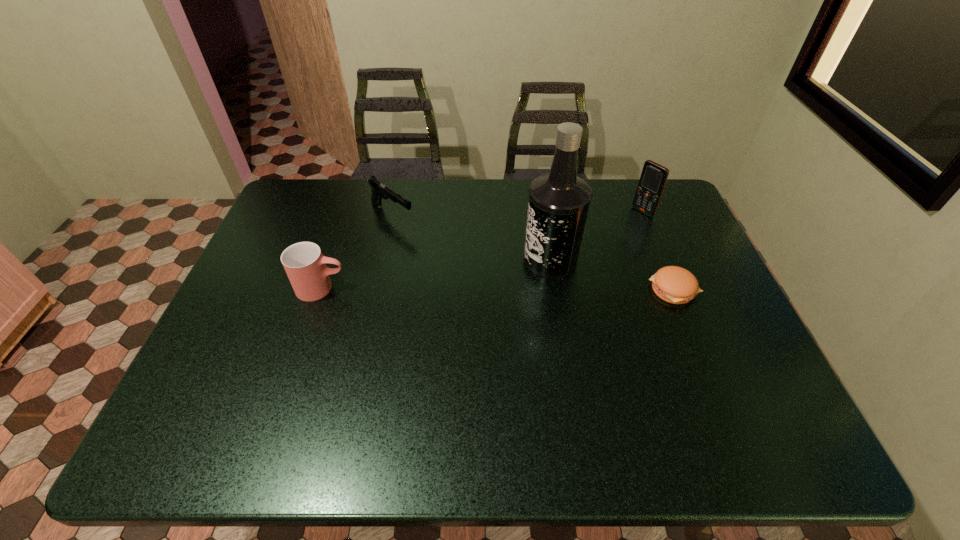
Find the location of a particular element. This screenshot has width=960, height=540. vacant space situated 0.400m on the screen of the second tallest object is located at coordinates (553, 272).

Where is `vacant space situated at the aiming end of the gun`? vacant space situated at the aiming end of the gun is located at coordinates (425, 240).

The height and width of the screenshot is (540, 960). What are the coordinates of `vacant space located 0.230m at the aiming end of the gun` in the screenshot? It's located at click(x=456, y=262).

Identify the location of free space located at the aiming end of the gun. (428, 241).

Identify the location of vacant space located on the front label of the tallest object. This screenshot has height=540, width=960. (466, 299).

You are a GUI agent. You are given a task and a screenshot of the screen. Output one action in this format:
    pyautogui.click(x=<x>, y=<y>)
    Task: Click on the vacant position located on the front label of the tallest object
    This screenshot has height=540, width=960.
    Given the screenshot: What is the action you would take?
    pyautogui.click(x=401, y=328)

Find the location of a particular element. vacant space located 0.140m on the front label of the tallest object is located at coordinates (487, 289).

I want to click on cellular telephone that is at the far edge, so click(653, 178).

This screenshot has width=960, height=540. I want to click on gun situated at the far edge, so click(x=379, y=190).

You are a GUI agent. You are given a task and a screenshot of the screen. Output one action in this format:
    pyautogui.click(x=<x>, y=<y>)
    Task: Click on the object that is at the left edge
    Image resolution: width=960 pixels, height=540 pixels.
    Given the screenshot: What is the action you would take?
    pyautogui.click(x=305, y=265)